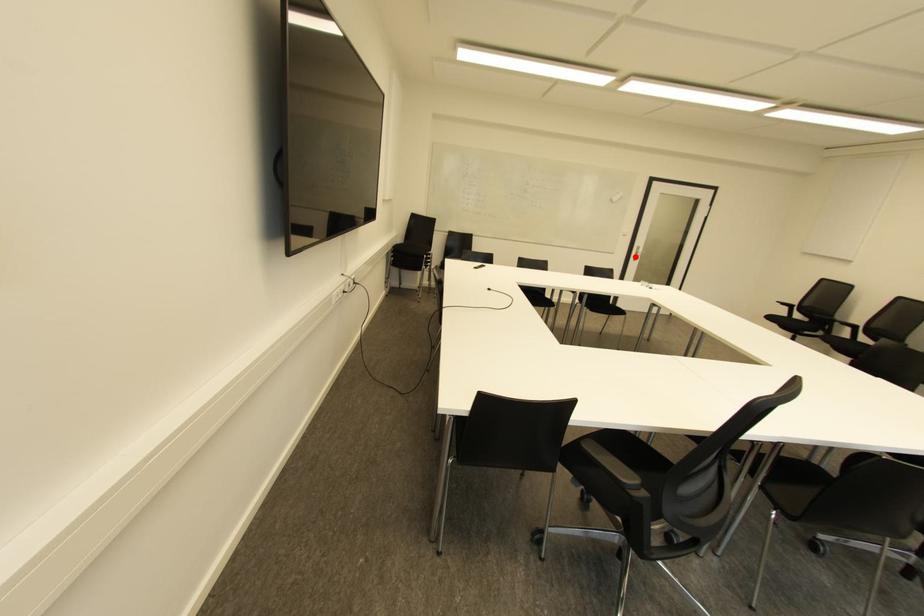
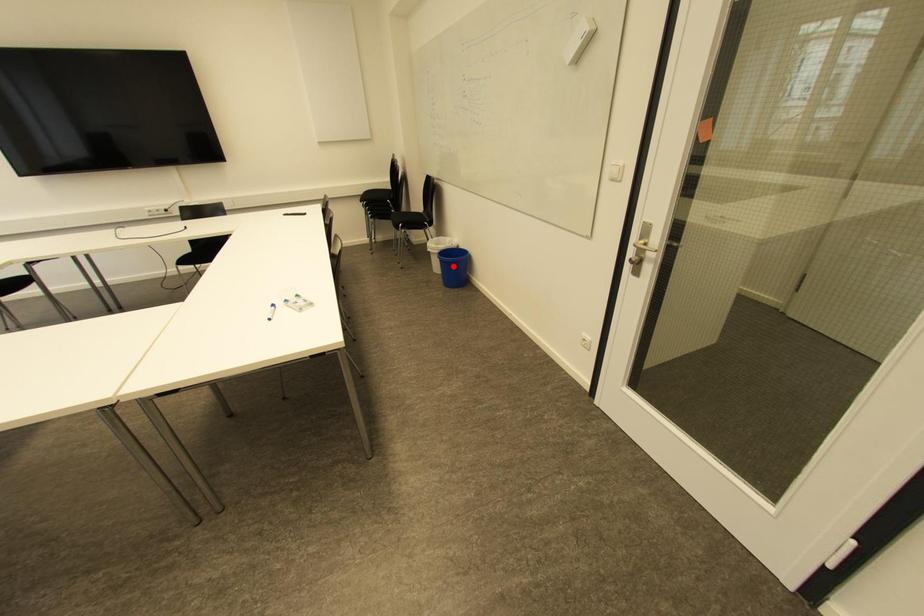
I am providing you with two images of the same scene from different viewpoints. A red point is marked on the first image and another point is marked on the second image. Are the points marked in image1 and image2 representing the same 3D position?

No